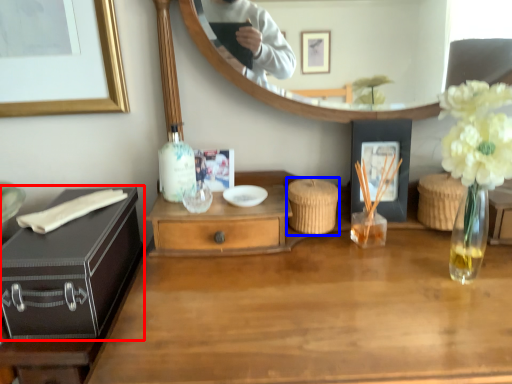
Question: Which of the following is the farthest to the observer, chest (highlighted by a red box) or picnic basket (highlighted by a blue box)?

Choices:
 (A) chest
 (B) picnic basket

Answer: (B)